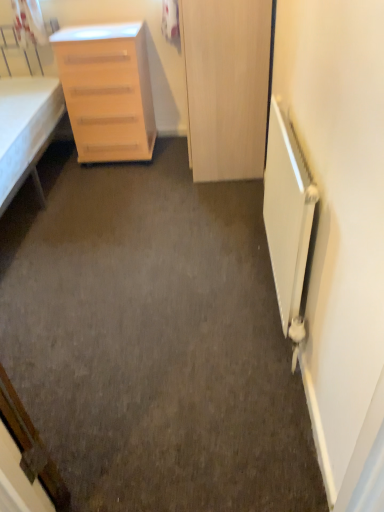
Where is `vacant space positioned to the left of wooden door at center`? This screenshot has height=512, width=384. vacant space positioned to the left of wooden door at center is located at coordinates (147, 172).